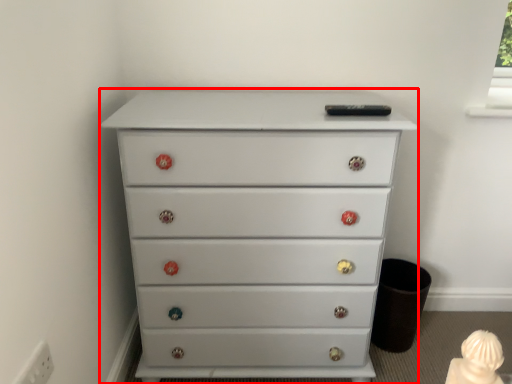
Question: From the image's perspective, what is the correct spatial relationship of chest of drawers (annotated by the red box) in relation to electric outlet?

Choices:
 (A) below
 (B) above

Answer: (B)